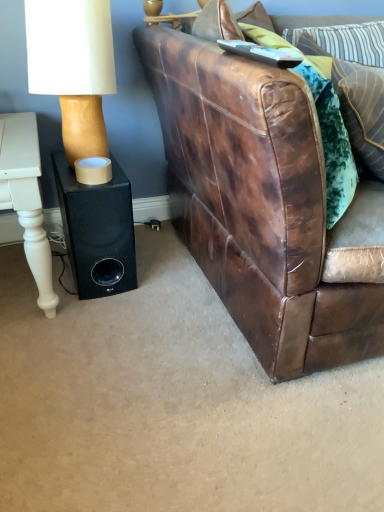
What do you see at coordinates (317, 113) in the screenshot? I see `velvet green pillow at upper right, which ranks as the 2th pillow in bottom-to-top order` at bounding box center [317, 113].

The height and width of the screenshot is (512, 384). Identify the location of black matte speaker at lower left. (97, 230).

Image resolution: width=384 pixels, height=512 pixels. What do you see at coordinates (27, 198) in the screenshot? I see `white painted wood table at left` at bounding box center [27, 198].

The image size is (384, 512). What do you see at coordinates (73, 67) in the screenshot?
I see `white matte lampshade at upper left` at bounding box center [73, 67].

Identify the location of green textured pillow at upper right, arranged as the 1th pillow when viewed from the top. Image resolution: width=384 pixels, height=512 pixels. (342, 42).

How much space does green textured pillow at upper right, arranged as the 1th pillow when viewed from the top, occupy horizontally?

6.42 inches.

At what (x,y) coordinates should I click in order to perform the action: click on velvet green pillow at upper right, which ranks as the 2th pillow in bottom-to-top order. Please return your answer as a coordinate pair (x, y). The width and height of the screenshot is (384, 512). Looking at the image, I should click on (317, 113).

Can you tell me how much brown leather couch at right and green textured pillow at upper right, arranged as the 1th pillow when viewed from the top, differ in facing direction?

0.000471 degrees.

Between brown leather couch at right and green textured pillow at upper right, arranged as the 1th pillow when viewed from the top, which one appears on the left side from the viewer's perspective?

Positioned to the left is green textured pillow at upper right, arranged as the 1th pillow when viewed from the top.

From a real-world perspective, is brown leather couch at right positioned over green textured pillow at upper right, arranged as the 1th pillow when viewed from the top, based on gravity?

No.

Between brown leather couch at right and green textured pillow at upper right, which is the third pillow in bottom-to-top order, which one is positioned in front?

brown leather couch at right is in front.

How far apart are velvet green pillow at upper right, the 1th pillow ordered from the bottom, and white matte lampshade at upper left?

velvet green pillow at upper right, the 1th pillow ordered from the bottom, is 26.07 inches away from white matte lampshade at upper left.

Considering the sizes of objects velvet green pillow at upper right, the 1th pillow ordered from the bottom, and white matte lampshade at upper left in the image provided, who is smaller, velvet green pillow at upper right, the 1th pillow ordered from the bottom, or white matte lampshade at upper left?

With smaller size is white matte lampshade at upper left.

Is the position of velvet green pillow at upper right, which is counted as the 3th pillow, starting from the top, more distant than that of white matte lampshade at upper left?

No, velvet green pillow at upper right, which is counted as the 3th pillow, starting from the top, is in front of white matte lampshade at upper left.

Is point (352, 114) closer or farther from the camera than point (98, 155)?

Point (352, 114) is closer to the camera than point (98, 155).

Between green textured pillow at upper right, which is the third pillow in bottom-to-top order, and white painted wood table at left, which one is positioned in front?

white painted wood table at left is closer to the camera.

From the picture: Is green textured pillow at upper right, which is the third pillow in bottom-to-top order, oriented away from white painted wood table at left?

That's not correct — green textured pillow at upper right, which is the third pillow in bottom-to-top order, is not looking away from white painted wood table at left.

Is green textured pillow at upper right, which is the third pillow in bottom-to-top order, with white painted wood table at left?

green textured pillow at upper right, which is the third pillow in bottom-to-top order, and white painted wood table at left are not in contact.

Is white matte lampshade at upper left looking in the opposite direction of white painted wood table at left?

That's not correct — white matte lampshade at upper left is not looking away from white painted wood table at left.

Is white matte lampshade at upper left to the right of white painted wood table at left from the viewer's perspective?

Yes.

Consider the image. Looking at the image, does white matte lampshade at upper left seem bigger or smaller compared to white painted wood table at left?

Clearly, white matte lampshade at upper left is smaller in size than white painted wood table at left.

Which object is further away from the camera taking this photo, white matte lampshade at upper left or white painted wood table at left?

white matte lampshade at upper left is behind.

From the image's perspective, between velvet green pillow at upper right, which is counted as the 3th pillow, starting from the top, and brown leather couch at right, who is located below?

From the image's view, brown leather couch at right is below.

Is velvet green pillow at upper right, which is counted as the 3th pillow, starting from the top, aimed at brown leather couch at right?

Yes, velvet green pillow at upper right, which is counted as the 3th pillow, starting from the top, is oriented towards brown leather couch at right.

From a real-world perspective, which object stands above the other?

velvet green pillow at upper right, the 1th pillow ordered from the bottom, from a real-world perspective.

Is velvet green pillow at upper right, which is counted as the 3th pillow, starting from the top, situated inside brown leather couch at right or outside?

velvet green pillow at upper right, which is counted as the 3th pillow, starting from the top, exists entirely within brown leather couch at right.

Which is farther from the camera, [231,272] or [102,244]?

Point [102,244]

Is brown leather couch at right facing away from black matte speaker at lower left?

brown leather couch at right is not turned away from black matte speaker at lower left.

Based on the photo, can you confirm if brown leather couch at right is smaller than black matte speaker at lower left?

No.

Is there a large distance between brown leather couch at right and black matte speaker at lower left?

That's not correct — brown leather couch at right is a little close to black matte speaker at lower left.

From a real-world perspective, is white painted wood table at left positioned above or below white matte lampshade at upper left?

From a real-world perspective, white painted wood table at left is physically below white matte lampshade at upper left.

Is white painted wood table at left far from white matte lampshade at upper left?

white painted wood table at left is actually quite close to white matte lampshade at upper left.

Which is more to the left, white painted wood table at left or white matte lampshade at upper left?

From the viewer's perspective, white painted wood table at left appears more on the left side.

Does white painted wood table at left have a greater height compared to white matte lampshade at upper left?

Yes.

Identify the location of pillow that is the 3rd object located behind the brown leather couch at right. (342, 42).

Where is `table lamp above the velvet green pillow at upper right, the 1th pillow ordered from the bottom (from the image's perspective)`? The width and height of the screenshot is (384, 512). table lamp above the velvet green pillow at upper right, the 1th pillow ordered from the bottom (from the image's perspective) is located at coordinates (73, 67).

From the image, which object appears to be nearer to velvet green pillow at upper right, which ranks as the 2th pillow in bottom-to-top order, velvet green pillow at upper right, which is counted as the 3th pillow, starting from the top, or white painted wood table at left?

velvet green pillow at upper right, which is counted as the 3th pillow, starting from the top, is positioned closer to the anchor velvet green pillow at upper right, which ranks as the 2th pillow in bottom-to-top order.

From the image, which object appears to be farther from brown leather couch at right, white painted wood table at left or black matte speaker at lower left?

The object further to brown leather couch at right is white painted wood table at left.

Based on the photo, based on their spatial positions, is green textured pillow at upper right, which is the third pillow in bottom-to-top order, or brown leather couch at right further from velvet green pillow at upper right, which ranks as the 2th pillow in bottom-to-top order?

green textured pillow at upper right, which is the third pillow in bottom-to-top order, is positioned further to the anchor velvet green pillow at upper right, which ranks as the 2th pillow in bottom-to-top order.

From the picture: Considering their positions, is velvet green pillow at upper right, the second pillow viewed from the top, positioned closer to green textured pillow at upper right, arranged as the 1th pillow when viewed from the top, than white painted wood table at left?

The object closer to green textured pillow at upper right, arranged as the 1th pillow when viewed from the top, is velvet green pillow at upper right, the second pillow viewed from the top.

Looking at the image, which one is located further to white painted wood table at left, velvet green pillow at upper right, the second pillow viewed from the top, or black matte speaker at lower left?

velvet green pillow at upper right, the second pillow viewed from the top.

From the image, which object appears to be farther from black matte speaker at lower left, velvet green pillow at upper right, the 1th pillow ordered from the bottom, or velvet green pillow at upper right, the second pillow viewed from the top?

The object further to black matte speaker at lower left is velvet green pillow at upper right, the 1th pillow ordered from the bottom.

Estimate the real-world distances between objects in this image. Which object is closer to white painted wood table at left, velvet green pillow at upper right, which is counted as the 3th pillow, starting from the top, or velvet green pillow at upper right, which ranks as the 2th pillow in bottom-to-top order?

The object closer to white painted wood table at left is velvet green pillow at upper right, which ranks as the 2th pillow in bottom-to-top order.

When comparing their distances from black matte speaker at lower left, does brown leather couch at right or velvet green pillow at upper right, the second pillow viewed from the top, seem further?

The object further to black matte speaker at lower left is velvet green pillow at upper right, the second pillow viewed from the top.

Find the location of `speaker located between white painted wood table at left and green textured pillow at upper right, which is the third pillow in bottom-to-top order, in the left-right direction`. speaker located between white painted wood table at left and green textured pillow at upper right, which is the third pillow in bottom-to-top order, in the left-right direction is located at coordinates (97, 230).

You are a GUI agent. You are given a task and a screenshot of the screen. Output one action in this format:
    pyautogui.click(x=<x>, y=<y>)
    Task: Click on the speaker between white painted wood table at left and velvet green pillow at upper right, which ranks as the 2th pillow in bottom-to-top order
    Image resolution: width=384 pixels, height=512 pixels.
    Given the screenshot: What is the action you would take?
    pyautogui.click(x=97, y=230)

This screenshot has height=512, width=384. What are the coordinates of `speaker situated between white matte lampshade at upper left and velvet green pillow at upper right, the 1th pillow ordered from the bottom, from left to right` in the screenshot? It's located at (97, 230).

Identify the location of table lamp located between white painted wood table at left and velvet green pillow at upper right, the second pillow viewed from the top, in the left-right direction. This screenshot has height=512, width=384. click(x=73, y=67).